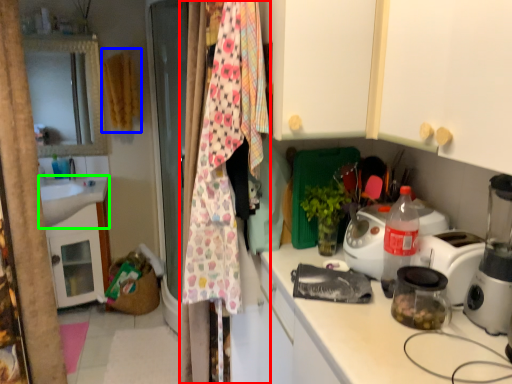
Question: Which is nearer to the clothesline (highlighted by a red box)? clothesline (highlighted by a blue box) or sink (highlighted by a green box).

Choices:
 (A) clothesline
 (B) sink

Answer: (A)